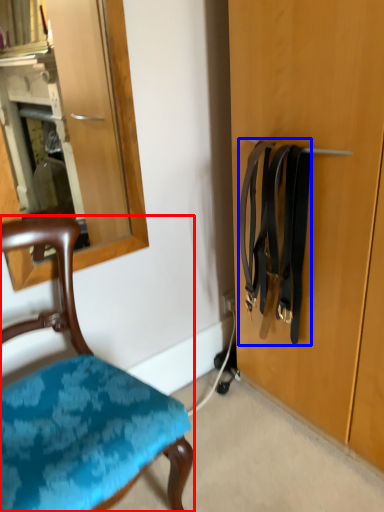
Question: Which of the following is the farthest to the observer, chair (highlighted by a red box) or suspenders (highlighted by a blue box)?

Choices:
 (A) chair
 (B) suspenders

Answer: (B)